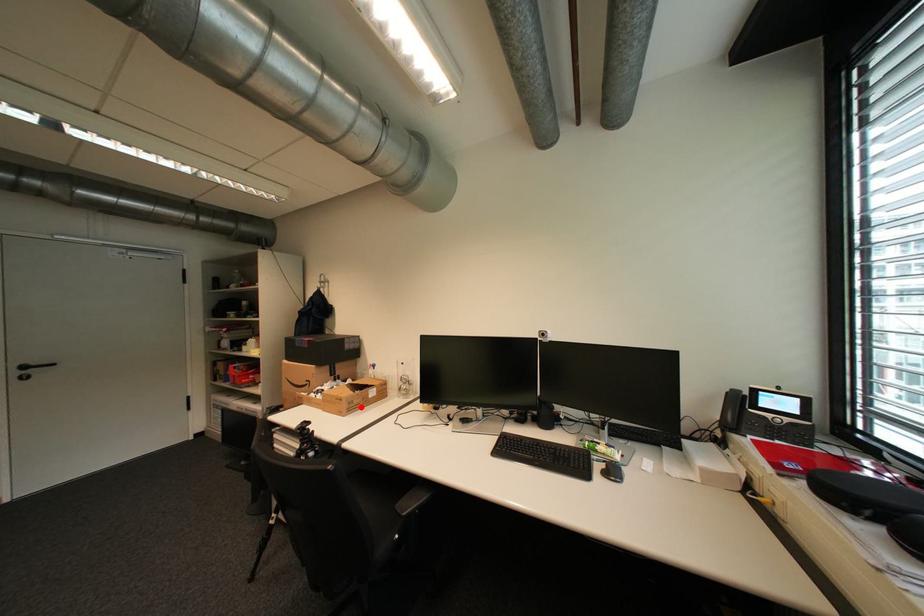
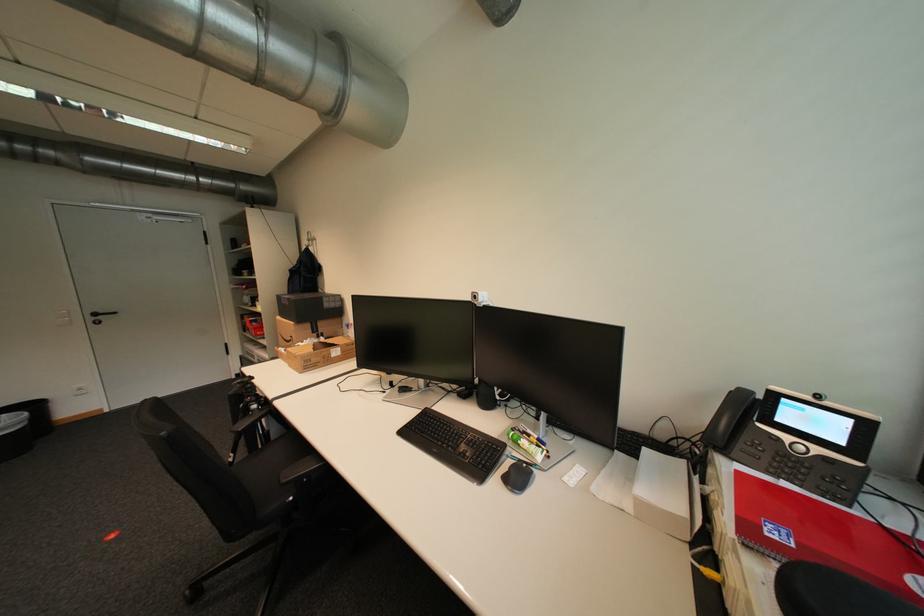
Locate, in the second image, the point that corresponds to the highlighted location in the first image.

(319, 365)